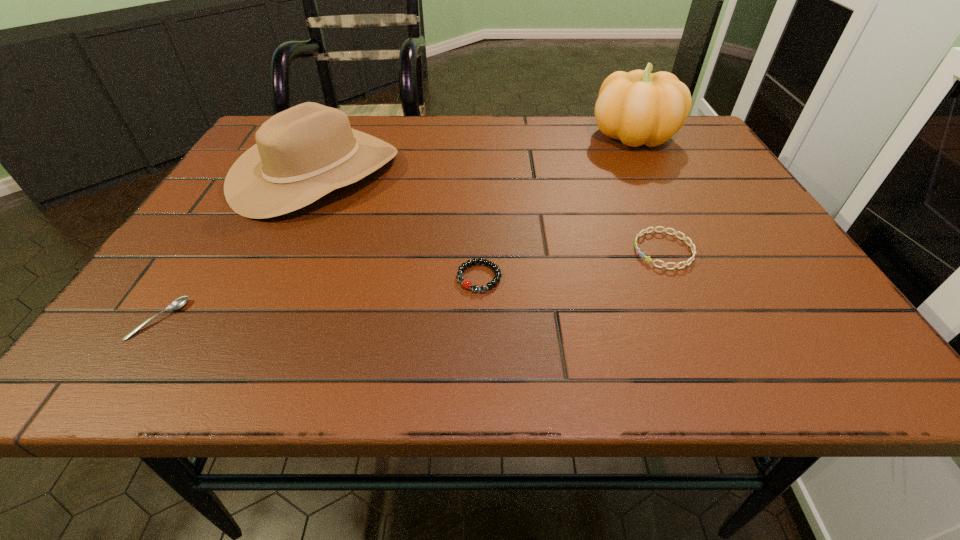
This screenshot has height=540, width=960. Find the location of `pumpkin`. pumpkin is located at coordinates (639, 107).

Where is `cowboy hat`? Image resolution: width=960 pixels, height=540 pixels. cowboy hat is located at coordinates (303, 153).

Identify the location of the right bracelet. (675, 233).

You are a GUI agent. You are given a task and a screenshot of the screen. Output one action in this format:
    pyautogui.click(x=<x>, y=<y>)
    Task: Click on the fourth tallest object
    Image resolution: width=960 pixels, height=540 pixels.
    Given the screenshot: What is the action you would take?
    pyautogui.click(x=465, y=283)

Identify the location of the shorter bracelet. (465, 283).

You are a GUI agent. You are given a task and a screenshot of the screen. Output one action in this format:
    pyautogui.click(x=<x>, y=<y>)
    Task: Click on the shortest object
    Image resolution: width=960 pixels, height=540 pixels.
    Given the screenshot: What is the action you would take?
    pyautogui.click(x=180, y=302)

Locate an element on the screen. The width and height of the screenshot is (960, 540). soupspoon is located at coordinates (180, 302).

Find the location of a particular element. Image resolution: width=960 pixels, height=540 pixels. vacant region located on the left of the pumpkin is located at coordinates (484, 134).

Image resolution: width=960 pixels, height=540 pixels. I want to click on vacant area situated on the front of the second tallest object, so click(x=258, y=295).

This screenshot has height=540, width=960. I want to click on vacant space located 0.100m on the surface of the right bracelet showing star-shaped elements, so click(x=583, y=250).